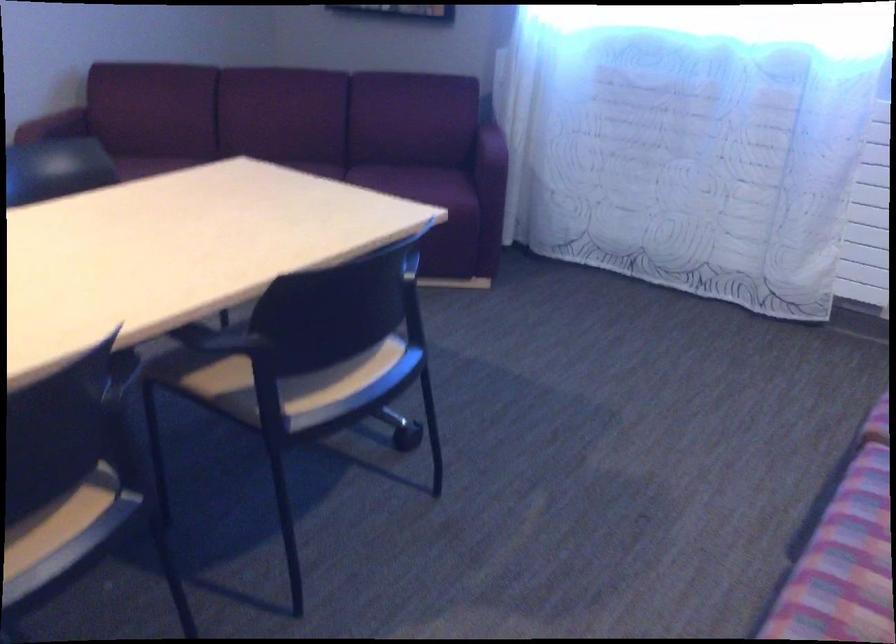
This screenshot has height=644, width=896. What do you see at coordinates (426, 183) in the screenshot?
I see `the sofa sitting surface` at bounding box center [426, 183].